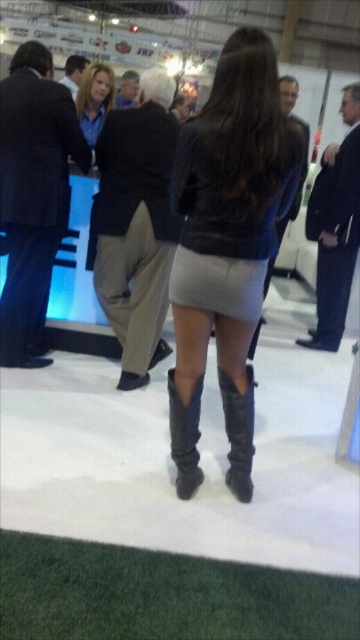
Who is more forward, (195, 401) or (196, 419)?

Point (195, 401) is in front.

Measure the distance between leather jacket at center and leather at center.

leather jacket at center and leather at center are 8.27 inches apart.

Between point (234, 268) and point (185, 492), which one is positioned in front?

Point (234, 268)

You are a GUI agent. You are given a task and a screenshot of the screen. Output one action in this format:
    pyautogui.click(x=<x>, y=<y>)
    Task: Click on the leather jacket at center
    The width and height of the screenshot is (360, 640).
    Given the screenshot: What is the action you would take?
    pyautogui.click(x=227, y=246)

From the picture: Is leather jacket at center to the right of leather boots at center from the viewer's perspective?

In fact, leather jacket at center is to the left of leather boots at center.

What do you see at coordinates (227, 246) in the screenshot? I see `leather jacket at center` at bounding box center [227, 246].

The width and height of the screenshot is (360, 640). In order to click on leather jacket at center in this screenshot , I will do `click(227, 246)`.

Is point (212, 205) closer to viewer compared to point (235, 468)?

Yes.

Is light gray leather skirt at center thinner than leather boots at center?

In fact, light gray leather skirt at center might be wider than leather boots at center.

The height and width of the screenshot is (640, 360). In order to click on light gray leather skirt at center in this screenshot , I will do `click(225, 202)`.

This screenshot has height=640, width=360. Find the location of `light gray leather skirt at center`. light gray leather skirt at center is located at coordinates (225, 202).